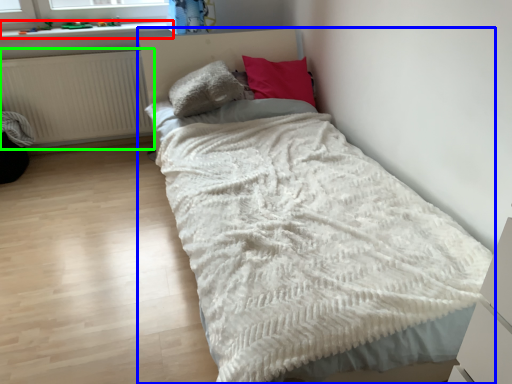
Question: Which object is positioned closest to window sill (highlighted by a red box)? Select from bed (highlighted by a blue box) and radiator (highlighted by a green box).

Choices:
 (A) bed
 (B) radiator

Answer: (B)